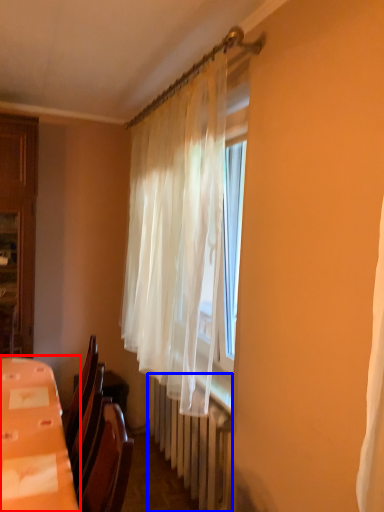
Question: Among these objects, which one is nearest to the camera, table (highlighted by a red box) or radiator (highlighted by a blue box)?

Choices:
 (A) table
 (B) radiator

Answer: (A)